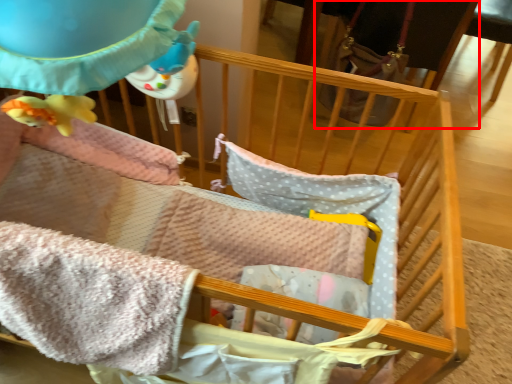
Question: From the image, what is the correct spatial relationship of feeding chair (annotated by the red box) in relation to blanket?

Choices:
 (A) left
 (B) right

Answer: (B)